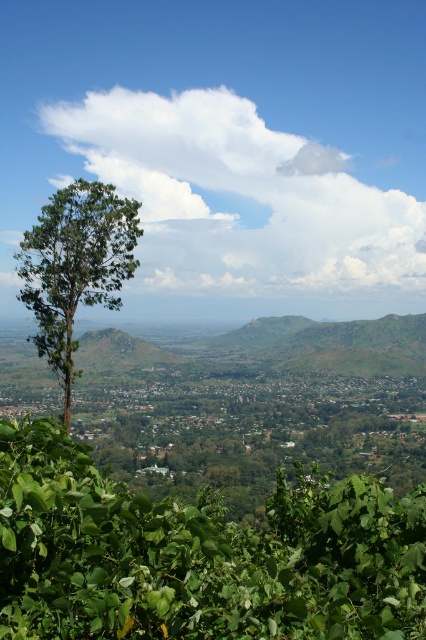
You are a drone operator planning to fly a drone from the green leafy tree at left to the white fluffy cloud at upper center. Given that the drone has a maximum flight range of 1500 feet, will it be able to reach the cloud without needing to recharge?

The distance between the green leafy tree at left and the white fluffy cloud at upper center is 1480.38 feet, which is under the drone operator drone maximum flight range of 1500 feet. Therefore, the drone can reach the white fluffy cloud at upper center without needing to recharge.

You are an airplane passenger looking out the window and see the white fluffy cloud at upper center and the green leafy tree at left. Which object is closer to the right edge of your view?

The white fluffy cloud at upper center is more on the right side of the green leafy tree at left, so it is closer to the right edge of your view.